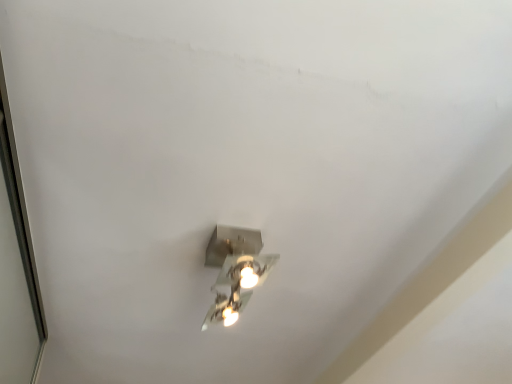
Question: Is metallic silver light fixture at center inside or outside of transparent glass door at left?

Choices:
 (A) inside
 (B) outside

Answer: (B)

Question: From a real-world perspective, is metallic silver light fixture at center positioned above or below transparent glass door at left?

Choices:
 (A) above
 (B) below

Answer: (A)

Question: Considering the relative positions of metallic silver light fixture at center and transparent glass door at left in the image provided, is metallic silver light fixture at center to the left or to the right of transparent glass door at left?

Choices:
 (A) left
 (B) right

Answer: (B)

Question: Is transparent glass door at left in front of or behind metallic silver light fixture at center in the image?

Choices:
 (A) behind
 (B) front

Answer: (B)

Question: From a real-world perspective, is transparent glass door at left above or below metallic silver light fixture at center?

Choices:
 (A) above
 (B) below

Answer: (B)

Question: Looking at the image, does transparent glass door at left seem bigger or smaller compared to metallic silver light fixture at center?

Choices:
 (A) small
 (B) big

Answer: (B)

Question: In terms of width, does transparent glass door at left look wider or thinner when compared to metallic silver light fixture at center?

Choices:
 (A) wide
 (B) thin

Answer: (B)